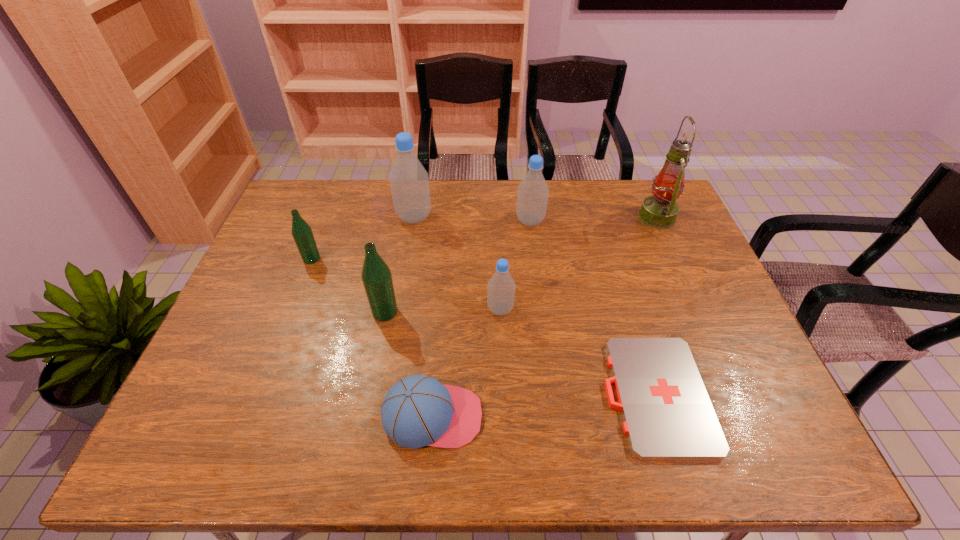
The image size is (960, 540). I want to click on oil lamp situated at the right edge, so click(660, 210).

Where is `the first-aid kit located at the right edge`? the first-aid kit located at the right edge is located at coordinates (667, 413).

This screenshot has height=540, width=960. Find the location of `object located in the far right corner section of the desktop`. object located in the far right corner section of the desktop is located at coordinates tap(660, 210).

Where is `object located at the near right corner`? This screenshot has height=540, width=960. object located at the near right corner is located at coordinates (667, 413).

In the image, there is a desktop. Identify the location of vacant space at the far edge. The image size is (960, 540). (458, 215).

I want to click on vacant space at the near edge, so tap(277, 439).

At what (x,y) coordinates should I click in order to perform the action: click on vacant space at the left edge of the desktop. Please return your answer as a coordinate pair (x, y). The image size is (960, 540). Looking at the image, I should click on (241, 334).

The height and width of the screenshot is (540, 960). Identify the location of vacant region at the right edge of the desktop. (684, 275).

Image resolution: width=960 pixels, height=540 pixels. What are the coordinates of `free space at the far left corner of the desktop` in the screenshot? It's located at (315, 218).

This screenshot has height=540, width=960. I want to click on vacant space at the near left corner of the desktop, so click(x=235, y=456).